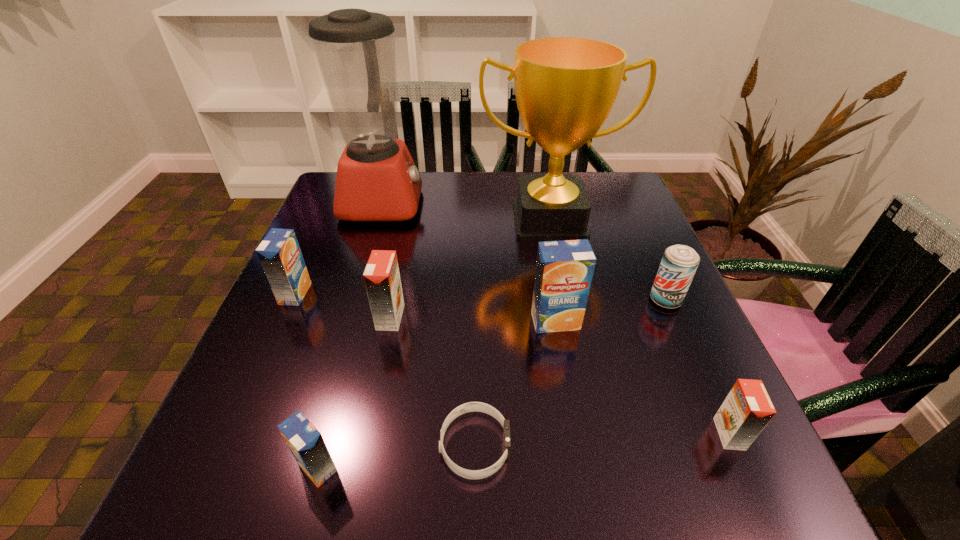
At what (x,y) coordinates should I click in order to perform the action: click on orange juice located at the right edge. Please return your answer as a coordinate pair (x, y). Image resolution: width=960 pixels, height=540 pixels. Looking at the image, I should click on (747, 409).

Locate an element on the screen. The image size is (960, 540). object that is at the far left corner is located at coordinates (377, 180).

In order to click on object that is positioned at the near left corner in this screenshot , I will do `click(306, 443)`.

At what (x,y) coordinates should I click in order to perform the action: click on object positioned at the far right corner. Please return your answer as a coordinate pair (x, y). This screenshot has width=960, height=540. Looking at the image, I should click on (565, 87).

Image resolution: width=960 pixels, height=540 pixels. I want to click on free space at the far edge, so click(x=505, y=182).

In the image, there is a desktop. Where is `vacant space at the left edge`? This screenshot has width=960, height=540. vacant space at the left edge is located at coordinates (282, 344).

Identify the location of vacant space at the right edge of the desktop. (662, 368).

At what (x,y) coordinates should I click in order to perform the action: click on vacant area at the far right corner of the desktop. Please return your answer as a coordinate pair (x, y). Looking at the image, I should click on (609, 177).

The image size is (960, 540). What are the coordinates of `free spot at the near right corner of the desktop` in the screenshot? It's located at (756, 507).

Where is `vacant space that is in between the farthest blue orange_juice and the third orange juice from left to right`? The width and height of the screenshot is (960, 540). vacant space that is in between the farthest blue orange_juice and the third orange juice from left to right is located at coordinates (343, 306).